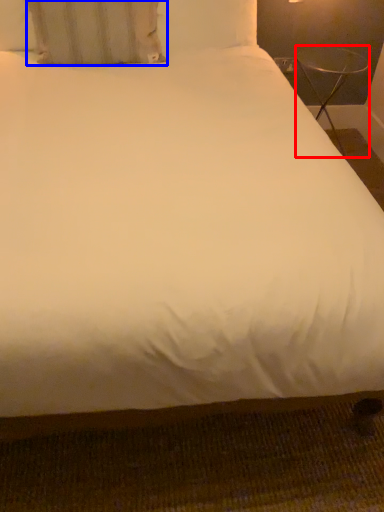
Question: Which object appears closest to the camera in this image, table (highlighted by a red box) or pillow (highlighted by a blue box)?

Choices:
 (A) table
 (B) pillow

Answer: (B)